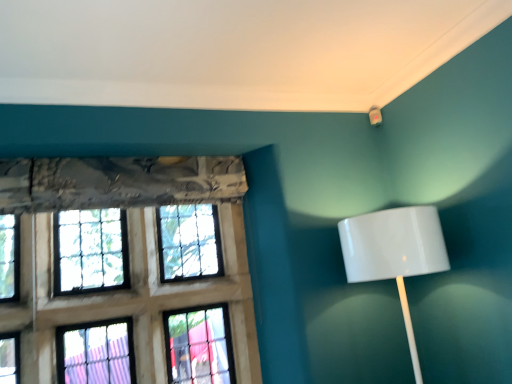
This screenshot has width=512, height=384. What do you see at coordinates (122, 299) in the screenshot? I see `stained glass window at left` at bounding box center [122, 299].

This screenshot has height=384, width=512. In order to click on stained glass window at left in this screenshot , I will do `click(122, 299)`.

Where is `white glossy lampshade at right`? The width and height of the screenshot is (512, 384). white glossy lampshade at right is located at coordinates (395, 253).

In order to face white glossy lampshade at right, should I rotate leftwards or rightwards?

To face it directly, rotate right by 19.236 degrees.

This screenshot has width=512, height=384. What do you see at coordinates (395, 253) in the screenshot? I see `white glossy lampshade at right` at bounding box center [395, 253].

Identify the location of stained glass window at left. The width and height of the screenshot is (512, 384). (122, 299).

Which is more to the right, stained glass window at left or white glossy lampshade at right?

Positioned to the right is white glossy lampshade at right.

Which is in front, stained glass window at left or white glossy lampshade at right?

white glossy lampshade at right is closer to the camera.

Considering the points (9, 312) and (373, 247), which point is behind, point (9, 312) or point (373, 247)?

The point (9, 312) is farther.

From the image's perspective, does stained glass window at left appear higher than white glossy lampshade at right?

No, from the image's perspective, stained glass window at left is not above white glossy lampshade at right.

From a real-world perspective, is stained glass window at left below white glossy lampshade at right?

No, from a real-world perspective, stained glass window at left is not under white glossy lampshade at right.

Looking at this image, is stained glass window at left thinner than white glossy lampshade at right?

Indeed, stained glass window at left has a lesser width compared to white glossy lampshade at right.

Consider the image. Considering the sizes of objects stained glass window at left and white glossy lampshade at right in the image provided, who is taller, stained glass window at left or white glossy lampshade at right?

stained glass window at left is taller.

Considering the sizes of stained glass window at left and white glossy lampshade at right in the image, is stained glass window at left bigger or smaller than white glossy lampshade at right?

Clearly, stained glass window at left is larger in size than white glossy lampshade at right.

Is white glossy lampshade at right completely or partially inside stained glass window at left?

No, white glossy lampshade at right is not a part of stained glass window at left.

Is stained glass window at left not near white glossy lampshade at right?

Yes.

Is stained glass window at left looking in the opposite direction of white glossy lampshade at right?

No, stained glass window at left's orientation is not away from white glossy lampshade at right.

How different are the orientations of stained glass window at left and white glossy lampshade at right in degrees?

2.92 degrees separate the facing orientations of stained glass window at left and white glossy lampshade at right.

The image size is (512, 384). Identify the location of window behind the white glossy lampshade at right. (122, 299).

Visually, is white glossy lampshade at right positioned to the left or to the right of stained glass window at left?

Clearly, white glossy lampshade at right is on the right of stained glass window at left in the image.

Does white glossy lampshade at right lie in front of stained glass window at left?

Yes, it is.

Which is closer to the camera, (343, 257) or (64, 354)?

Point (343, 257).

From the image's perspective, which one is positioned higher, white glossy lampshade at right or stained glass window at left?

white glossy lampshade at right.

From a real-world perspective, is white glossy lampshade at right positioned under stained glass window at left based on gravity?

Yes, from a real-world perspective, white glossy lampshade at right is below stained glass window at left.

Looking at their sizes, would you say white glossy lampshade at right is wider or thinner than stained glass window at left?

Clearly, white glossy lampshade at right has more width compared to stained glass window at left.

In the scene shown: In terms of height, does white glossy lampshade at right look taller or shorter compared to stained glass window at left?

white glossy lampshade at right is shorter than stained glass window at left.

Does white glossy lampshade at right have a smaller size compared to stained glass window at left?

Correct, white glossy lampshade at right occupies less space than stained glass window at left.

Is white glossy lampshade at right not inside stained glass window at left?

white glossy lampshade at right lies outside stained glass window at left's area.

Is white glossy lampshade at right far from stained glass window at left?

Yes, white glossy lampshade at right is far from stained glass window at left.

Is white glossy lampshade at right positioned with its back to stained glass window at left?

white glossy lampshade at right is not turned away from stained glass window at left.

How different are the orientations of white glossy lampshade at right and stained glass window at left in degrees?

The angular difference between white glossy lampshade at right and stained glass window at left is 2.92 degrees.

Measure the distance between white glossy lampshade at right and stained glass window at left.

They are 1.13 meters apart.

You are a GUI agent. You are given a task and a screenshot of the screen. Output one action in this format:
    pyautogui.click(x=<x>, y=<y>)
    Task: Click on the window on the left of white glossy lampshade at right
    The height and width of the screenshot is (384, 512).
    Given the screenshot: What is the action you would take?
    pyautogui.click(x=122, y=299)

The image size is (512, 384). I want to click on lamp lying on the right of stained glass window at left, so click(395, 253).

Where is `window lying on the left of white glossy lampshade at right`? window lying on the left of white glossy lampshade at right is located at coordinates (122, 299).